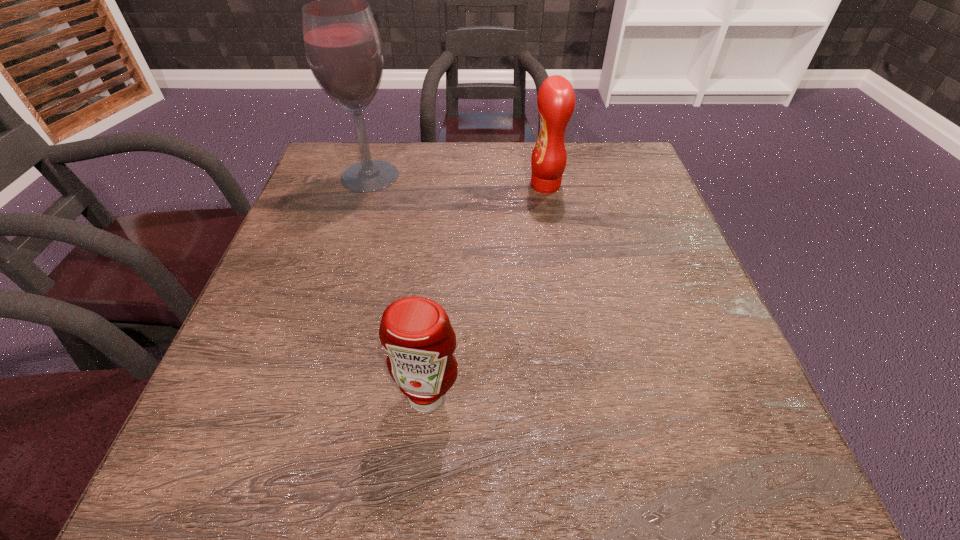
Identify the location of free space located on the right of the nearest object. This screenshot has width=960, height=540. (660, 396).

What are the coordinates of `alcohol that is at the far edge` in the screenshot? It's located at (343, 47).

Where is `condiment located in the far edge section of the desktop`? The height and width of the screenshot is (540, 960). condiment located in the far edge section of the desktop is located at coordinates (556, 99).

I want to click on object positioned at the left edge, so click(343, 47).

This screenshot has width=960, height=540. What are the coordinates of `object that is at the far left corner` in the screenshot? It's located at (343, 47).

Find the location of a particular element. Image resolution: width=960 pixels, height=540 pixels. free space at the far edge of the desktop is located at coordinates (433, 175).

I want to click on blank space at the near edge of the desktop, so click(x=497, y=497).

At what (x,y) coordinates should I click in order to perform the action: click on vacant space at the left edge of the desktop. Please return your answer as a coordinate pair (x, y). This screenshot has height=540, width=960. Looking at the image, I should click on (252, 333).

You are a GUI agent. You are given a task and a screenshot of the screen. Output one action in this format:
    pyautogui.click(x=<x>, y=<y>)
    Task: Click on the free space at the right edge of the desktop
    The width and height of the screenshot is (960, 540).
    Given the screenshot: What is the action you would take?
    pyautogui.click(x=657, y=282)

Find the location of a particular element. This screenshot has height=540, width=960. free space at the far left corner is located at coordinates (345, 168).